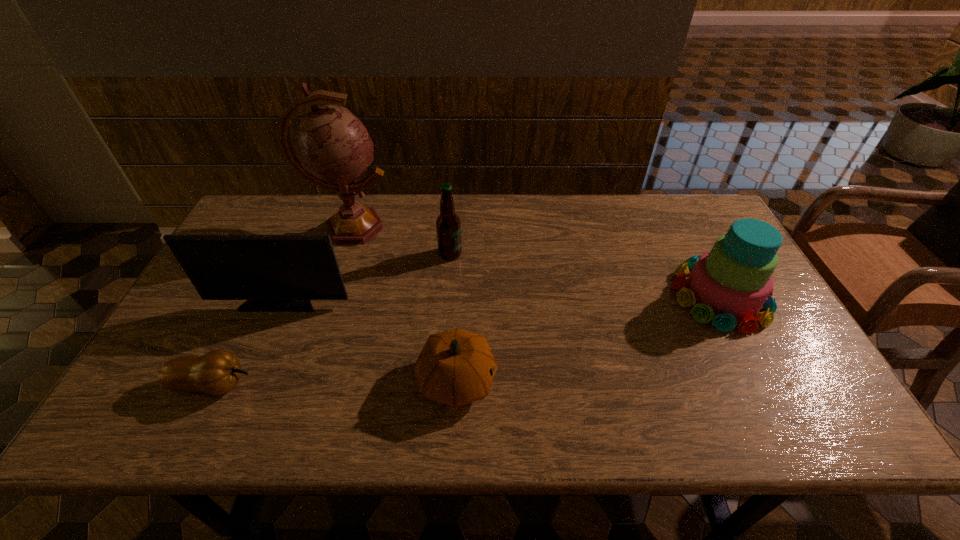
Where is `the second closest object to the monitor`? Image resolution: width=960 pixels, height=540 pixels. the second closest object to the monitor is located at coordinates (333, 149).

You are a GUI agent. You are given a task and a screenshot of the screen. Output one action in this format:
    pyautogui.click(x=<x>, y=<y>)
    Task: Click on the free location that satisfies the following two spatial constraints: 1. on the front-facing side of the rightmost object; 2. on the right side of the tallest object
    
    Given the screenshot: What is the action you would take?
    pyautogui.click(x=328, y=295)

The width and height of the screenshot is (960, 540). Find the location of `free space that satisfies the following two spatial constraints: 1. on the screen side of the monitor; 2. on the stem side of the shortest object`. free space that satisfies the following two spatial constraints: 1. on the screen side of the monitor; 2. on the stem side of the shortest object is located at coordinates (246, 384).

Locate an element on the screen. This screenshot has width=960, height=540. vacant space that satisfies the following two spatial constraints: 1. on the front-facing side of the cake; 2. on the left side of the globe is located at coordinates (328, 295).

This screenshot has height=540, width=960. I want to click on vacant point that satisfies the following two spatial constraints: 1. on the label of the beer bottle; 2. on the screen side of the monitor, so click(x=446, y=301).